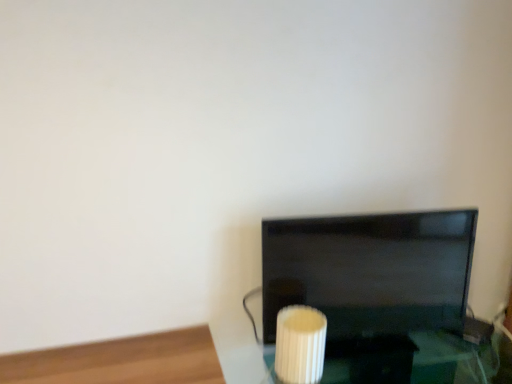
What are the coordinates of `free space underneath black glossy tv at center (from a real-world perspective)` in the screenshot? It's located at (395, 343).